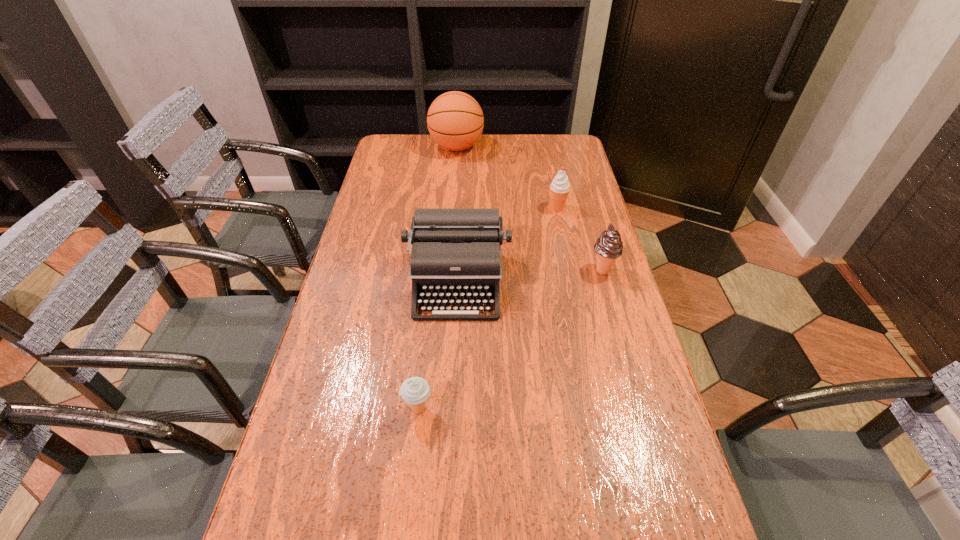
The width and height of the screenshot is (960, 540). Identify the location of free region located on the typing side of the typewriter. (452, 389).

What are the coordinates of `vacant space situated 0.360m on the back of the second farthest icecream` in the screenshot? It's located at (581, 192).

Find the location of a particular element. free space located on the back of the second farthest object is located at coordinates (543, 145).

The width and height of the screenshot is (960, 540). What are the coordinates of `blank space located on the front of the leftmost icecream` in the screenshot? It's located at (411, 474).

The image size is (960, 540). Find the location of `object located in the far edge section of the desktop`. object located in the far edge section of the desktop is located at coordinates (455, 121).

In the image, there is a desktop. At what (x,y) coordinates should I click in order to perform the action: click on blank space at the far edge. Please return your answer as a coordinate pair (x, y). This screenshot has height=540, width=960. Looking at the image, I should click on (489, 152).

Locate an element on the screen. vacant space at the left edge is located at coordinates (361, 300).

Where is `vacant area at the right edge of the desktop`? The image size is (960, 540). vacant area at the right edge of the desktop is located at coordinates (581, 194).

The image size is (960, 540). In the image, there is a desktop. In order to click on free region at the far right corner in this screenshot , I will do `click(580, 151)`.

Where is `vacant space that is in between the shortest object and the typewriter`? The width and height of the screenshot is (960, 540). vacant space that is in between the shortest object and the typewriter is located at coordinates (438, 346).